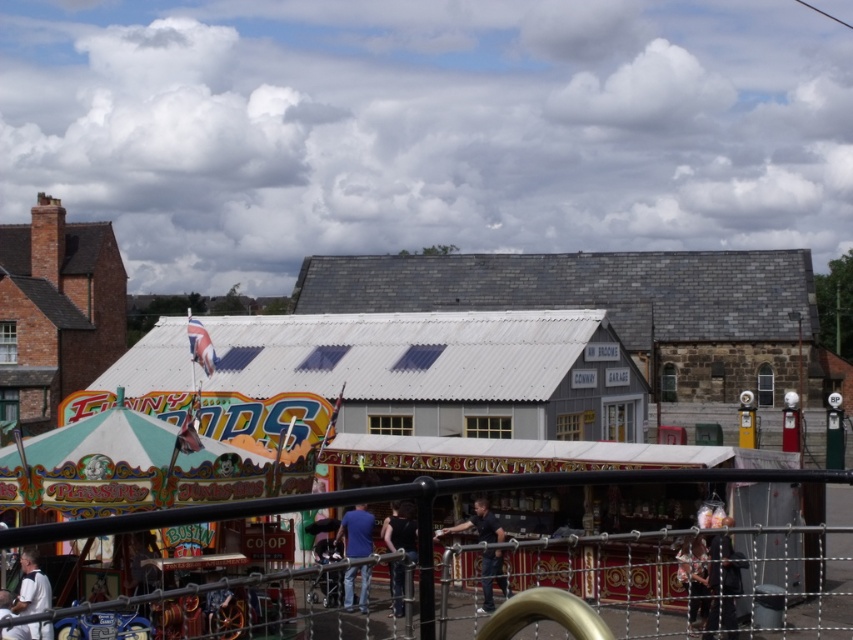
Which of these two, metallic chain-link fence at lower center or blue fabric shirt at center, stands shorter?

metallic chain-link fence at lower center

Looking at this image, is the position of metallic chain-link fence at lower center more distant than that of blue fabric shirt at center?

No, metallic chain-link fence at lower center is in front of blue fabric shirt at center.

I want to click on metallic chain-link fence at lower center, so click(x=651, y=584).

Between point (525, 561) and point (485, 563), which one is positioned in front?

Point (485, 563)

From the picture: Between metallic chain-link fence at lower center and dark blue shirt at center, which one appears on the right side from the viewer's perspective?

metallic chain-link fence at lower center is more to the right.

Between point (115, 620) and point (485, 508), which one is positioned behind?

Point (485, 508)

You are a GUI agent. You are given a task and a screenshot of the screen. Output one action in this format:
    pyautogui.click(x=<x>, y=<y>)
    Task: Click on the metallic chain-link fence at lower center
    This screenshot has width=853, height=640.
    Given the screenshot: What is the action you would take?
    pyautogui.click(x=651, y=584)

How distant is dark blue jeans at center from light blue jeans at lower left?

dark blue jeans at center and light blue jeans at lower left are 12.10 meters apart from each other.

Does dark blue jeans at center appear over light blue jeans at lower left?

No.

Is point (401, 588) positioned before point (4, 611)?

No, it is not.

Find the location of a particular element. dark blue jeans at center is located at coordinates (401, 529).